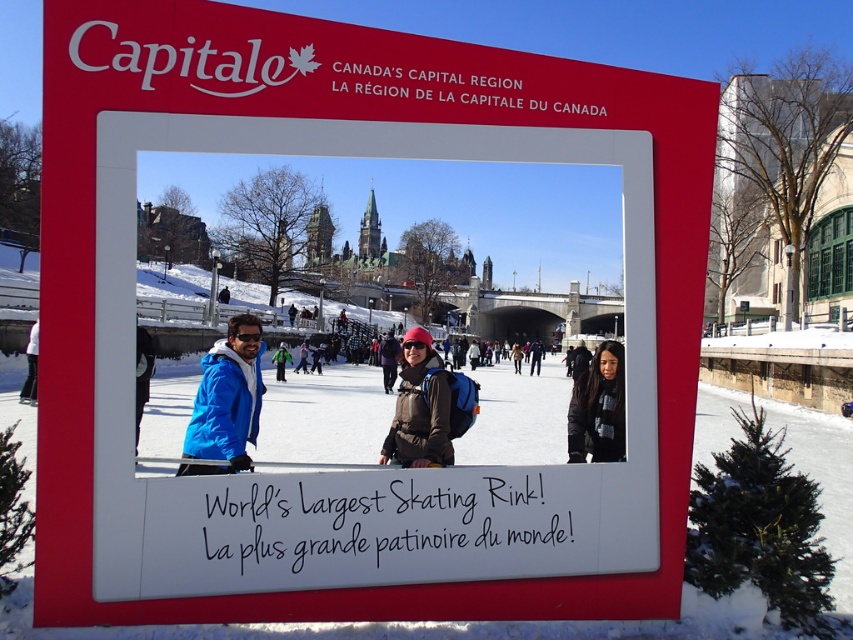
Question: Can you confirm if brown matte jacket at center is bigger than black wool scarf at lower right?

Choices:
 (A) yes
 (B) no

Answer: (A)

Question: Which of the following is the farthest from the observer?

Choices:
 (A) (448, 436)
 (B) (24, 352)
 (C) (142, 337)

Answer: (B)

Question: Estimate the real-world distances between objects in this image. Which object is farther from the blue fabric jacket at lower left?

Choices:
 (A) blue fabric jacket at left
 (B) matte brown jacket at center
 (C) blue fleece jacket at center
 (D) brown matte jacket at center

Answer: (B)

Question: Which object is the farthest from the green snowsuit at center?

Choices:
 (A) black wool scarf at lower right
 (B) blue fabric jacket at left

Answer: (A)

Question: Is blue fabric jacket at lower left below matte brown jacket at center?

Choices:
 (A) no
 (B) yes

Answer: (A)

Question: Can you confirm if black wool scarf at lower right is wider than matte brown jacket at center?

Choices:
 (A) yes
 (B) no

Answer: (A)